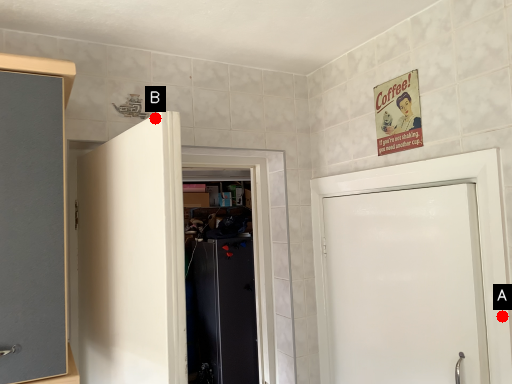
Question: Two points are circled on the image, labeled by A and B beside each circle. Which point is closer to the camera?

Choices:
 (A) A is closer
 (B) B is closer

Answer: (B)